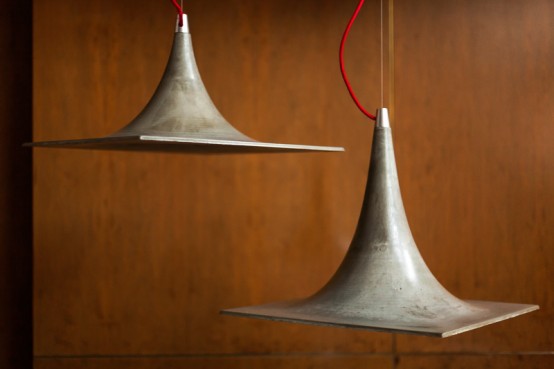
Find the location of a particular element. bottom left of the wall is located at coordinates pos(316,359).